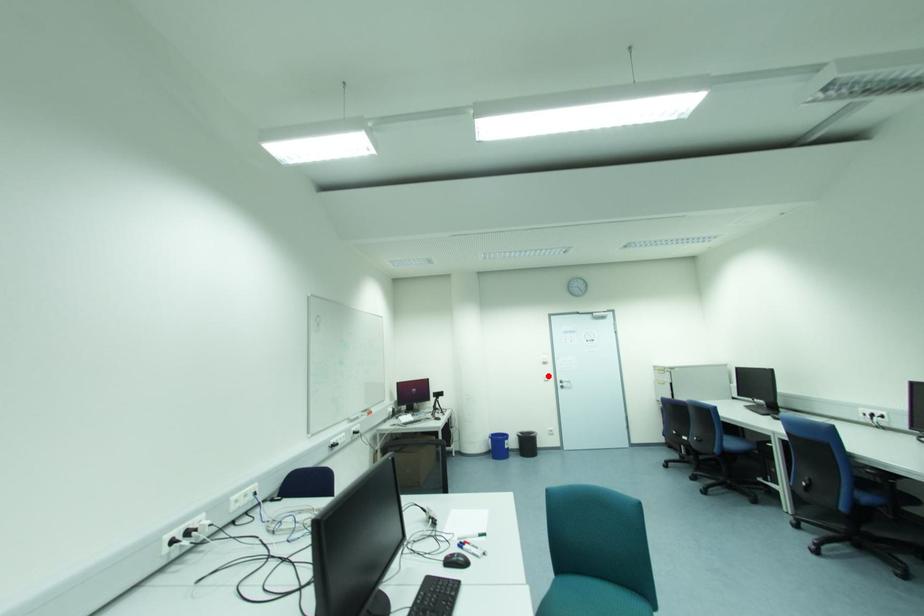
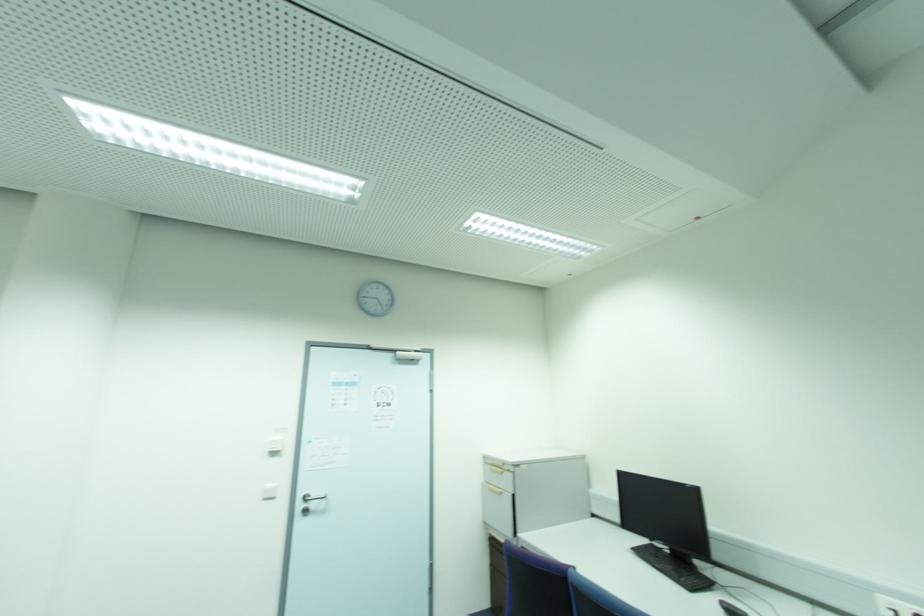
Question: I am providing you with two images of the same scene from different viewpoints. Image1 has a red point marked. In image2, the corresponding 3D location appears at what relative position? Reply with the corresponding letter.

Choices:
 (A) Closer
 (B) Farther

Answer: (A)